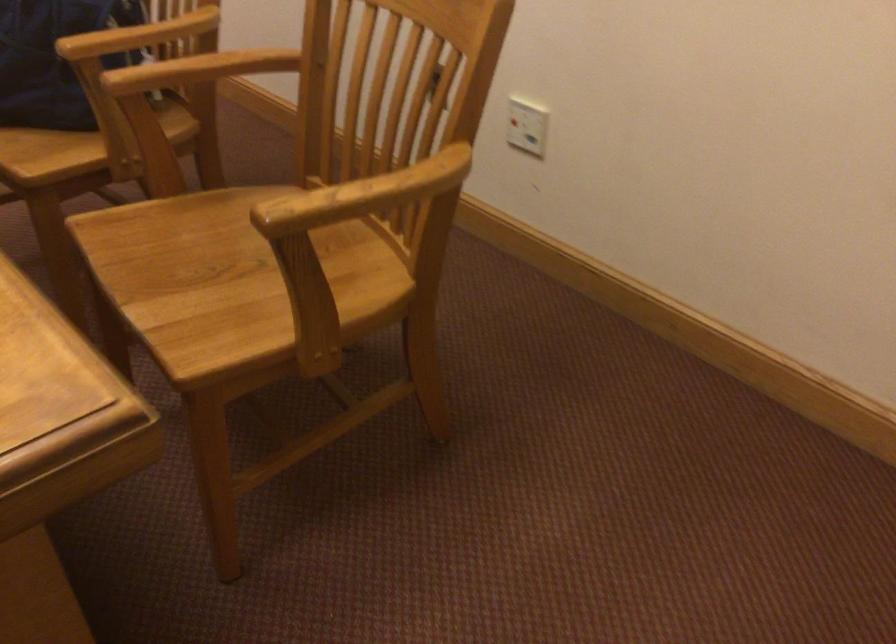
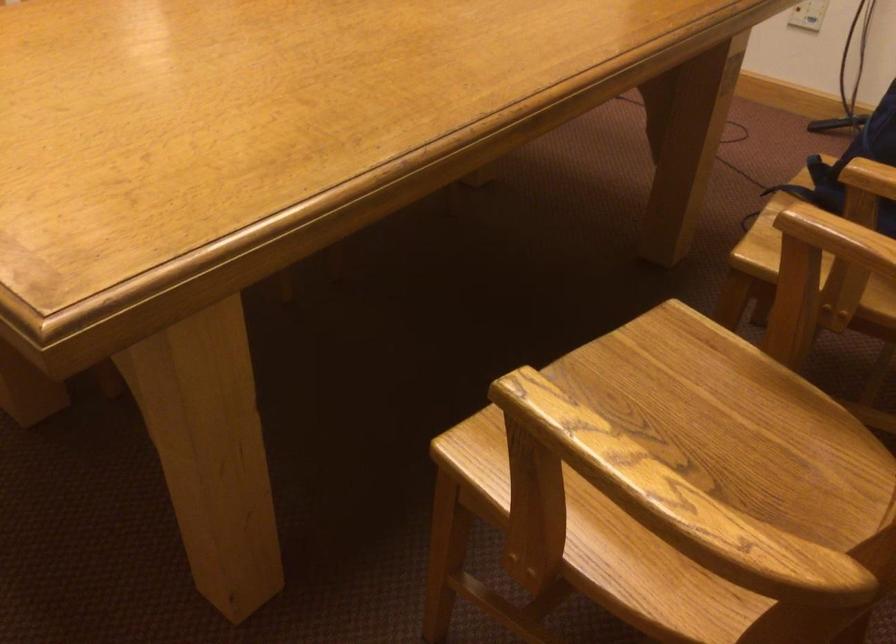
Based on the continuous images, in which direction is the camera rotating?

The rotation direction of the camera is left-down.